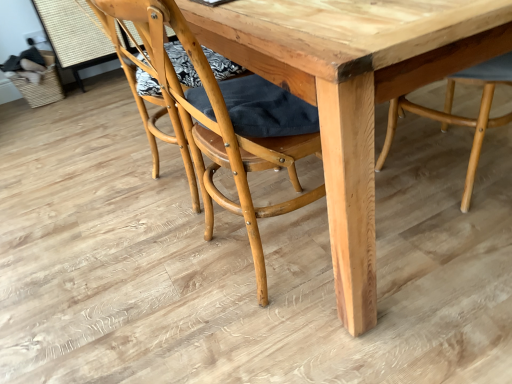
Question: Is natural wood chair at center, the first chair when ordered from left to right, next to natural wood table at center and touching it?

Choices:
 (A) yes
 (B) no

Answer: (B)

Question: Could you tell me if natural wood chair at center, the first chair when ordered from left to right, is facing natural wood table at center?

Choices:
 (A) no
 (B) yes

Answer: (B)

Question: Does natural wood chair at center, the first chair when ordered from left to right, lie in front of natural wood table at center?

Choices:
 (A) yes
 (B) no

Answer: (B)

Question: Is natural wood chair at center, positioned as the 2th chair in right-to-left order, at the left side of natural wood table at center?

Choices:
 (A) yes
 (B) no

Answer: (A)

Question: Would you say natural wood chair at center, positioned as the 2th chair in right-to-left order, contains natural wood table at center?

Choices:
 (A) no
 (B) yes

Answer: (A)

Question: In the image, is natural wood chair at center, which is counted as the first chair, starting from the right, positioned in front of or behind natural wood chair at center, the first chair when ordered from left to right?

Choices:
 (A) front
 (B) behind

Answer: (B)

Question: Would you say natural wood chair at center, the 2th chair in the left-to-right sequence, is to the left or to the right of natural wood chair at center, the first chair when ordered from left to right, in the picture?

Choices:
 (A) left
 (B) right

Answer: (B)

Question: From their relative heights in the image, would you say natural wood chair at center, which is counted as the first chair, starting from the right, is taller or shorter than natural wood chair at center, the first chair when ordered from left to right?

Choices:
 (A) tall
 (B) short

Answer: (B)

Question: Looking at the image, does natural wood chair at center, the 2th chair in the left-to-right sequence, seem bigger or smaller compared to natural wood chair at center, positioned as the 2th chair in right-to-left order?

Choices:
 (A) big
 (B) small

Answer: (B)

Question: Considering the positions of point (267, 117) and point (478, 6), is point (267, 117) closer or farther from the camera than point (478, 6)?

Choices:
 (A) farther
 (B) closer

Answer: (A)

Question: Looking at their shapes, would you say natural wood chair at center, positioned as the 2th chair in right-to-left order, is wider or thinner than natural wood table at center?

Choices:
 (A) thin
 (B) wide

Answer: (A)

Question: Is natural wood chair at center, positioned as the 2th chair in right-to-left order, spatially inside natural wood table at center, or outside of it?

Choices:
 (A) outside
 (B) inside

Answer: (B)

Question: Based on their sizes in the image, would you say natural wood chair at center, positioned as the 2th chair in right-to-left order, is bigger or smaller than natural wood table at center?

Choices:
 (A) small
 (B) big

Answer: (A)

Question: Is point tap(464, 9) positioned closer to the camera than point tap(449, 104)?

Choices:
 (A) closer
 (B) farther

Answer: (A)

Question: In terms of size, does natural wood table at center appear bigger or smaller than natural wood chair at center, which is counted as the first chair, starting from the right?

Choices:
 (A) small
 (B) big

Answer: (B)